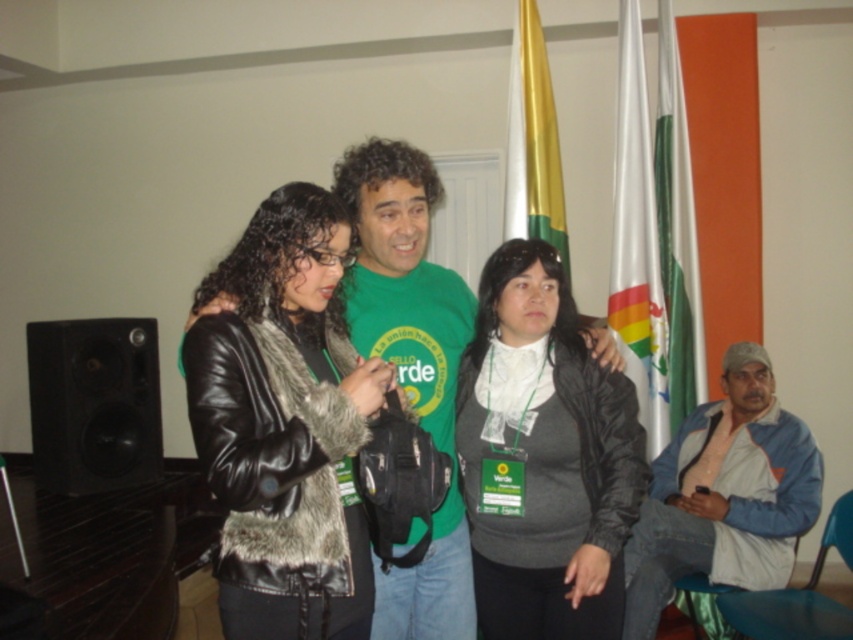
Can you confirm if matte black jacket at center is wider than white fabric flag at upper right?

Yes.

Can you confirm if matte black jacket at center is bigger than white fabric flag at upper right?

Indeed, matte black jacket at center has a larger size compared to white fabric flag at upper right.

Does point (584, 620) come farther from viewer compared to point (621, 100)?

No, it is in front of (621, 100).

This screenshot has height=640, width=853. What are the coordinates of `matte black jacket at center` in the screenshot? It's located at (544, 458).

Which is more to the right, leather fur vest at center or green matte shirt at center?

Positioned to the right is green matte shirt at center.

Is leather fur vest at center wider than green matte shirt at center?

Correct, the width of leather fur vest at center exceeds that of green matte shirt at center.

Locate an element on the screen. leather fur vest at center is located at coordinates (283, 422).

Can you confirm if white fabric flag at upper right is positioned below green fabric flag at right?

Indeed, white fabric flag at upper right is positioned under green fabric flag at right.

What do you see at coordinates (637, 241) in the screenshot?
I see `white fabric flag at upper right` at bounding box center [637, 241].

Where is `white fabric flag at upper right`? Image resolution: width=853 pixels, height=640 pixels. white fabric flag at upper right is located at coordinates pyautogui.click(x=637, y=241).